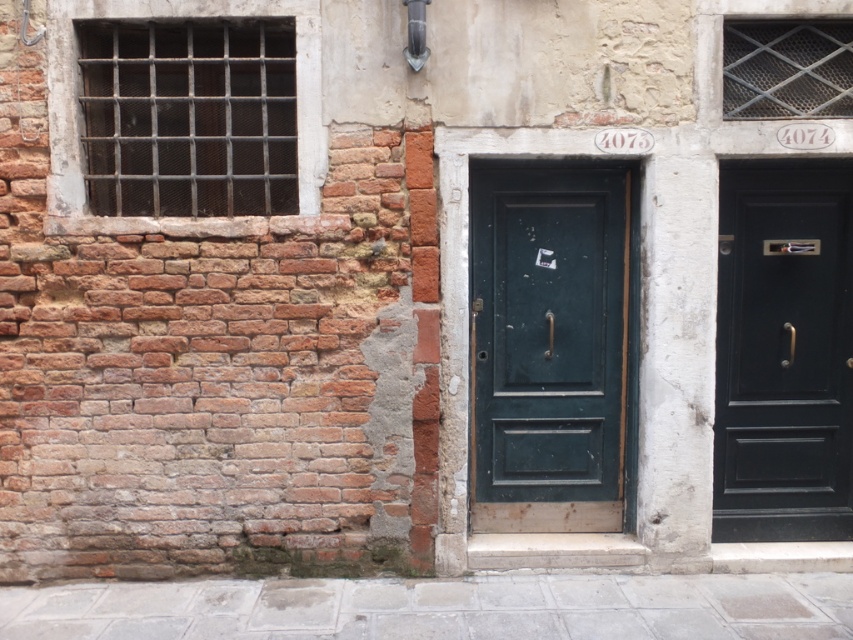
Who is higher up, dark green wooden door at center or matte black door at center right?

dark green wooden door at center

Between point (508, 400) and point (842, 410), which one is positioned behind?

Positioned behind is point (842, 410).

I want to click on dark green wooden door at center, so click(548, 346).